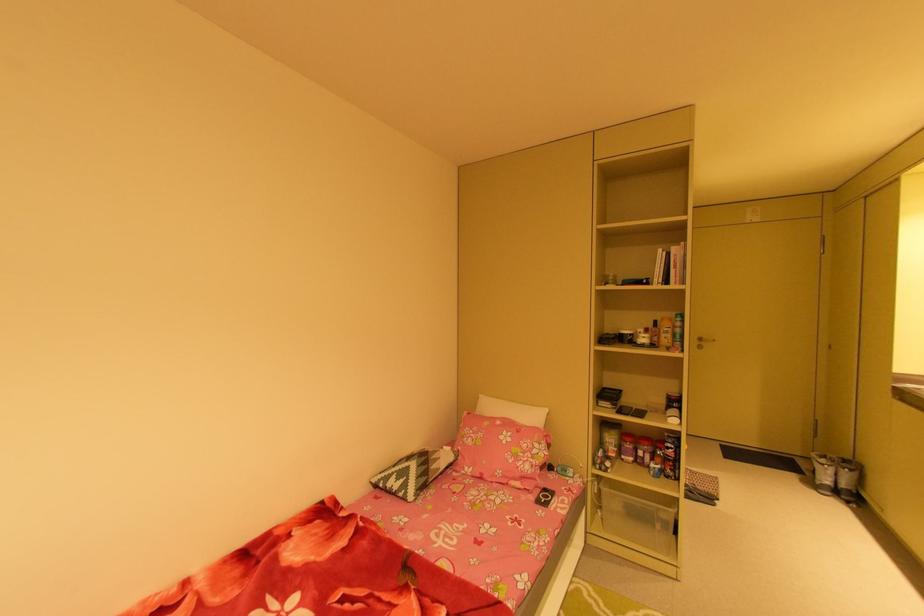
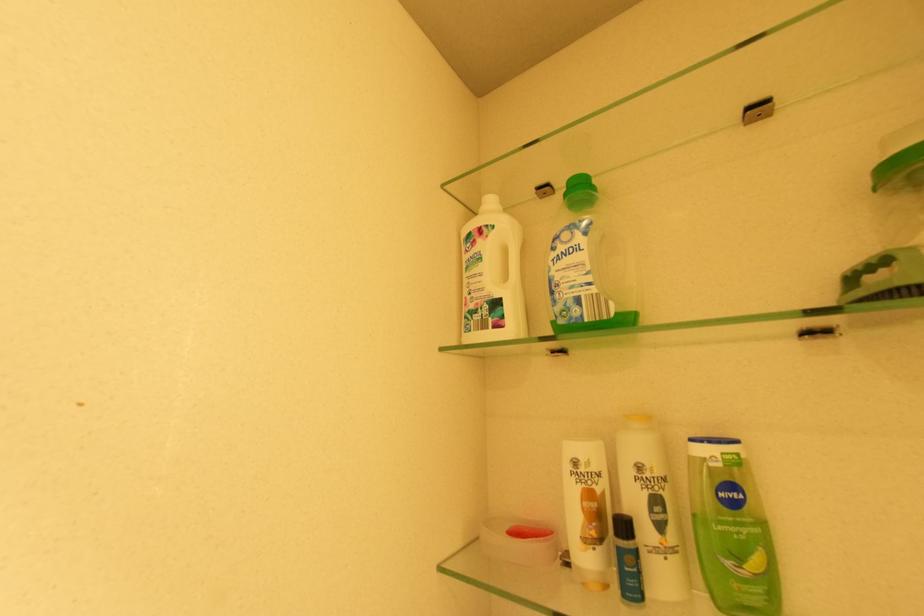
Question: What movement of the cameraman would produce the second image?

Choices:
 (A) Left
 (B) Right
 (C) Forward
 (D) Backward

Answer: (C)